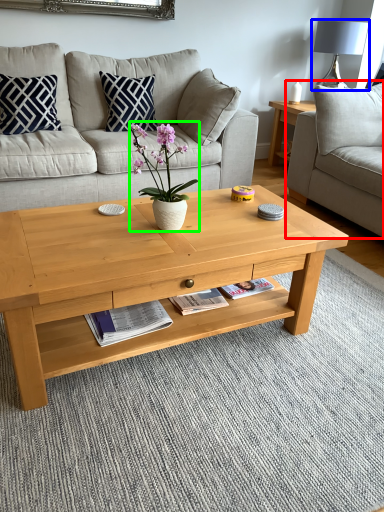
Question: Based on their relative distances, which object is farther from studio couch (highlighted by a red box)? Choose from lamp (highlighted by a blue box) and houseplant (highlighted by a green box).

Choices:
 (A) lamp
 (B) houseplant

Answer: (B)